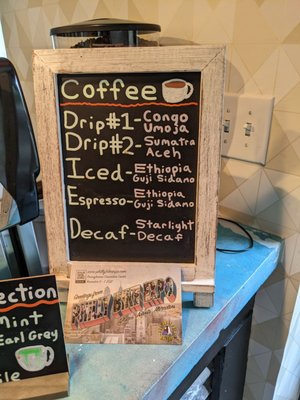
I want to click on wall of tiles, so click(x=255, y=62).